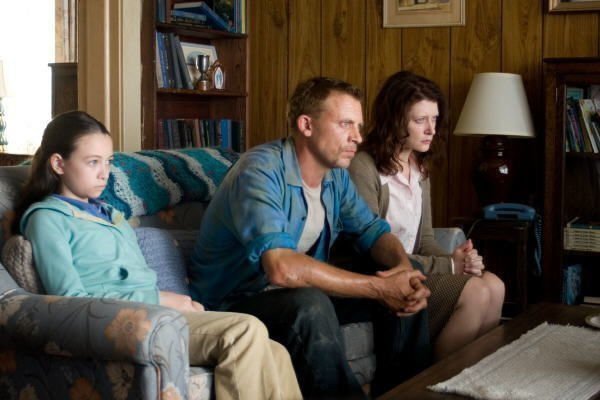
Where is `lamp`? Image resolution: width=600 pixels, height=400 pixels. lamp is located at coordinates (495, 119).